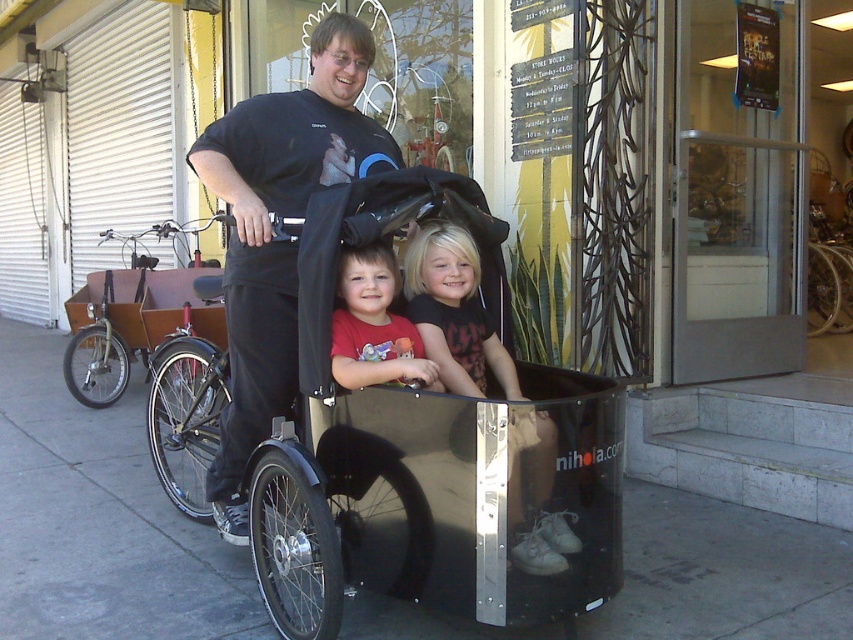
Who is taller, matte black child at center or matte red shirt at center?

matte black child at center is taller.

Does matte black child at center have a smaller size compared to matte red shirt at center?

Actually, matte black child at center might be larger than matte red shirt at center.

Does point (442, 285) come in front of point (383, 316)?

No.

What are the coordinates of `matte black child at center` in the screenshot? It's located at (454, 310).

Is shiny black cargo bike at center wider than black rubber pavement at lower center?

Yes, shiny black cargo bike at center is wider than black rubber pavement at lower center.

Locate an element on the screen. shiny black cargo bike at center is located at coordinates (427, 456).

What do you see at coordinates (99, 518) in the screenshot? I see `black rubber pavement at lower center` at bounding box center [99, 518].

Who is more distant from viewer, (624, 497) or (245, 336)?

Positioned behind is point (624, 497).

I want to click on black rubber pavement at lower center, so click(x=99, y=518).